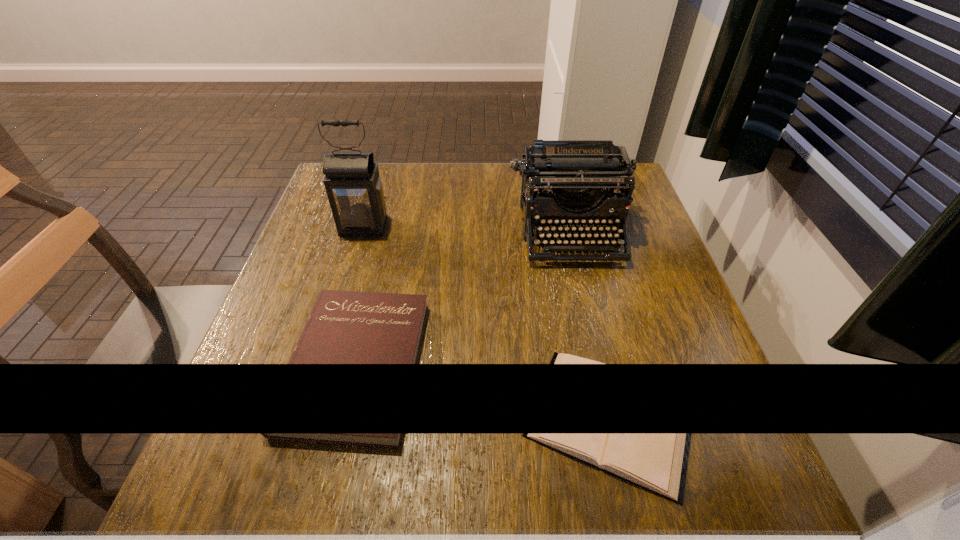
Locate an element on the screen. vacant space in between the typewriter and the third tallest object is located at coordinates (464, 298).

Image resolution: width=960 pixels, height=540 pixels. Find the location of `object that is the closest one to the third shortest object`. object that is the closest one to the third shortest object is located at coordinates (344, 327).

Locate which object is the third closest to the left hardback book. Please provide its 2D coordinates. Your answer should be formatted as a tuple, i.e. [(x, y)], where the tuple contains the x and y coordinates of a point satisfying the conditions above.

[(569, 175)]

Find the location of `free region that satisfies the following two spatial constraints: 1. on the front-facing side of the second shortest object; 2. on the right side of the lantern`. free region that satisfies the following two spatial constraints: 1. on the front-facing side of the second shortest object; 2. on the right side of the lantern is located at coordinates (323, 363).

Where is `vacant point that satisfies the following two spatial constraints: 1. on the front-facing side of the right hardback book; 2. on the right side of the lantern`? The height and width of the screenshot is (540, 960). vacant point that satisfies the following two spatial constraints: 1. on the front-facing side of the right hardback book; 2. on the right side of the lantern is located at coordinates (307, 417).